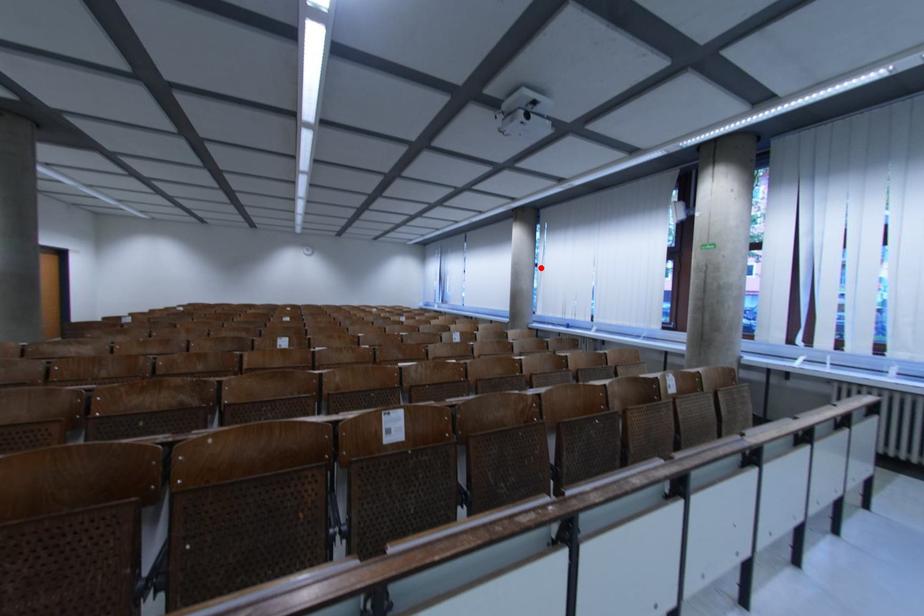
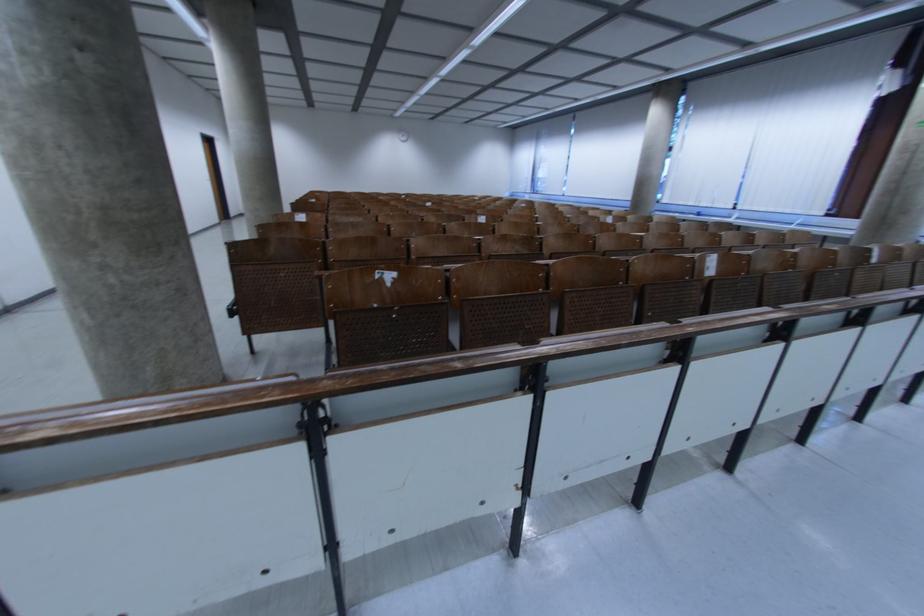
Locate, in the second image, the point that corresponds to the highlighted location in the first image.

(675, 152)